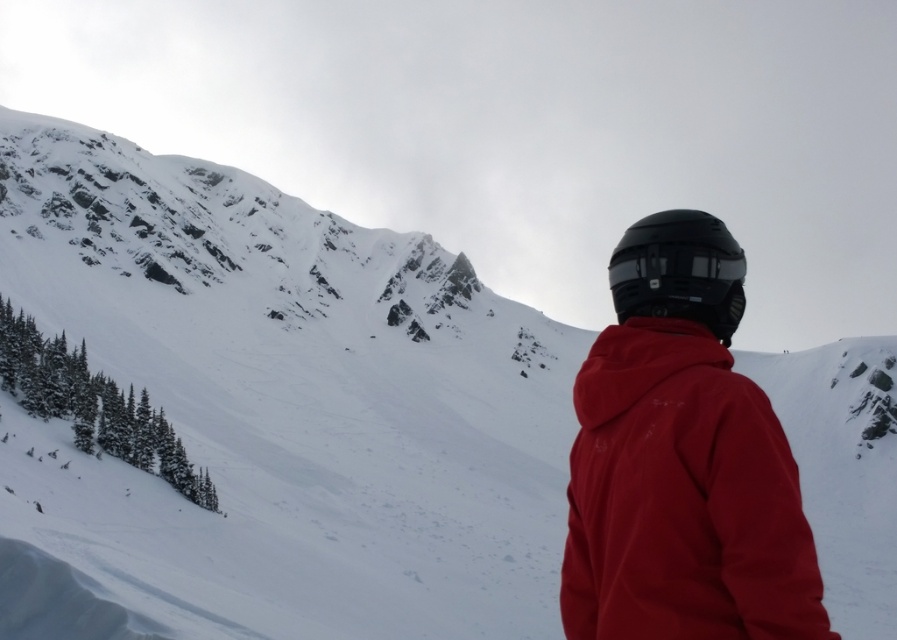
Question: Is black matte helmet at center below black matte helmet at upper center?

Choices:
 (A) yes
 (B) no

Answer: (A)

Question: Which is nearer to the black matte helmet at upper center?

Choices:
 (A) matte red jacket at center
 (B) black matte helmet at center

Answer: (B)

Question: Among these objects, which one is farthest from the camera?

Choices:
 (A) black matte helmet at upper center
 (B) matte red jacket at center

Answer: (A)

Question: Is matte red jacket at center bigger than black matte helmet at center?

Choices:
 (A) no
 (B) yes

Answer: (B)

Question: Which point is farther to the camera?

Choices:
 (A) (667, 253)
 (B) (785, 506)
 (C) (724, 288)

Answer: (A)

Question: Does matte red jacket at center have a greater width compared to black matte helmet at center?

Choices:
 (A) no
 (B) yes

Answer: (B)